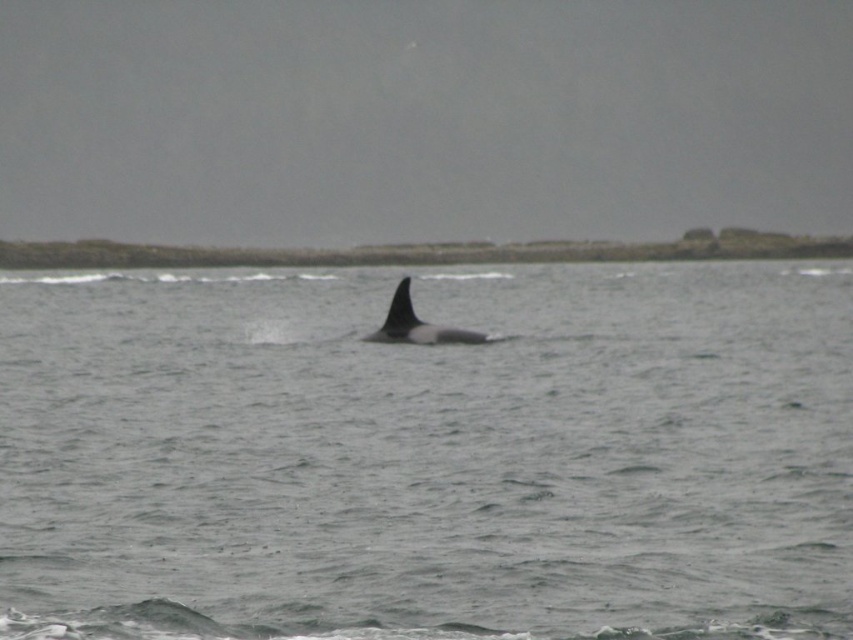
Question: Which object appears farthest from the camera in this image?

Choices:
 (A) gray matte water at center
 (B) black smooth whale at center

Answer: (B)

Question: Is gray matte water at center smaller than black smooth whale at center?

Choices:
 (A) no
 (B) yes

Answer: (A)

Question: Which point is farther to the camera?

Choices:
 (A) black smooth whale at center
 (B) gray matte water at center

Answer: (A)

Question: Can you confirm if gray matte water at center is positioned to the left of black smooth whale at center?

Choices:
 (A) yes
 (B) no

Answer: (B)

Question: Can you confirm if gray matte water at center is bigger than black smooth whale at center?

Choices:
 (A) no
 (B) yes

Answer: (B)